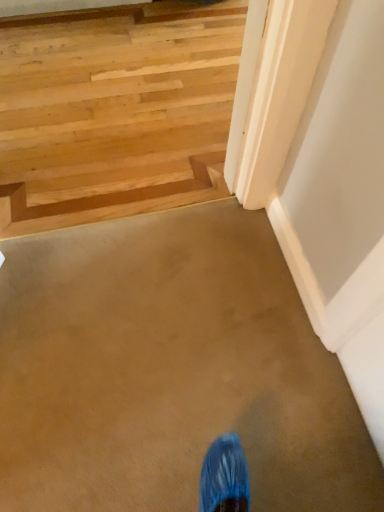
Question: Does light brown wood at upper left have a smaller size compared to natural wood stairs at upper left?

Choices:
 (A) no
 (B) yes

Answer: (B)

Question: Is natural wood stairs at upper left at the back of light brown wood at upper left?

Choices:
 (A) no
 (B) yes

Answer: (B)

Question: Does light brown wood at upper left have a larger size compared to natural wood stairs at upper left?

Choices:
 (A) no
 (B) yes

Answer: (A)

Question: Is the depth of light brown wood at upper left greater than that of natural wood stairs at upper left?

Choices:
 (A) no
 (B) yes

Answer: (B)

Question: From a real-world perspective, is light brown wood at upper left beneath natural wood stairs at upper left?

Choices:
 (A) no
 (B) yes

Answer: (A)

Question: Is light brown wood at upper left to the right of natural wood stairs at upper left from the viewer's perspective?

Choices:
 (A) no
 (B) yes

Answer: (A)

Question: From a real-world perspective, is natural wood stairs at upper left located higher than light brown wood at upper left?

Choices:
 (A) no
 (B) yes

Answer: (A)

Question: Is natural wood stairs at upper left outside of light brown wood at upper left?

Choices:
 (A) yes
 (B) no

Answer: (A)

Question: Considering the relative sizes of natural wood stairs at upper left and light brown wood at upper left in the image provided, is natural wood stairs at upper left bigger than light brown wood at upper left?

Choices:
 (A) yes
 (B) no

Answer: (A)

Question: From a real-world perspective, is natural wood stairs at upper left below light brown wood at upper left?

Choices:
 (A) no
 (B) yes

Answer: (B)

Question: From the image's perspective, is natural wood stairs at upper left beneath light brown wood at upper left?

Choices:
 (A) yes
 (B) no

Answer: (B)

Question: Does natural wood stairs at upper left appear on the left side of light brown wood at upper left?

Choices:
 (A) no
 (B) yes

Answer: (A)

Question: Choose the correct answer: Is natural wood stairs at upper left inside light brown wood at upper left or outside it?

Choices:
 (A) inside
 (B) outside

Answer: (B)